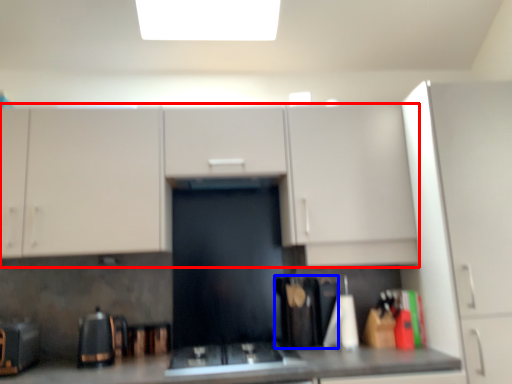
Question: Among these objects, which one is farthest to the camera, cabinetry (highlighted by a red box) or appliance (highlighted by a blue box)?

Choices:
 (A) cabinetry
 (B) appliance

Answer: (B)